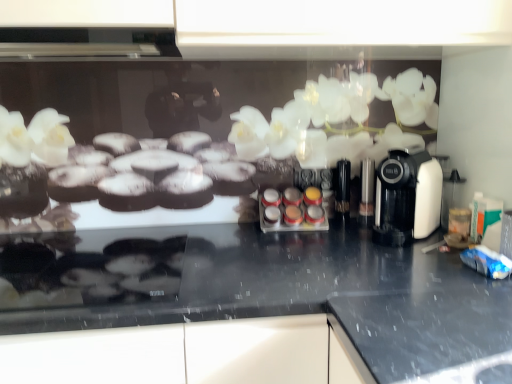
Question: Is white plastic coffee machine at right behind black granite countertop at center?

Choices:
 (A) no
 (B) yes

Answer: (B)

Question: Is white plastic coffee machine at right facing away from black granite countertop at center?

Choices:
 (A) no
 (B) yes

Answer: (A)

Question: Is white plastic coffee machine at right to the right of black granite countertop at center from the viewer's perspective?

Choices:
 (A) no
 (B) yes

Answer: (B)

Question: Can you confirm if white plastic coffee machine at right is bigger than black granite countertop at center?

Choices:
 (A) no
 (B) yes

Answer: (A)

Question: From the image's perspective, is white plastic coffee machine at right on black granite countertop at center?

Choices:
 (A) no
 (B) yes

Answer: (B)

Question: Is black granite countertop at center surrounded by white plastic coffee machine at right?

Choices:
 (A) no
 (B) yes

Answer: (A)

Question: Is white plastic coffee machine at right to the right of translucent plastic spice rack at center from the viewer's perspective?

Choices:
 (A) no
 (B) yes

Answer: (B)

Question: Is white plastic coffee machine at right facing away from translucent plastic spice rack at center?

Choices:
 (A) no
 (B) yes

Answer: (A)

Question: From the image's perspective, would you say white plastic coffee machine at right is shown under translucent plastic spice rack at center?

Choices:
 (A) no
 (B) yes

Answer: (A)

Question: Is the depth of white plastic coffee machine at right greater than that of translucent plastic spice rack at center?

Choices:
 (A) no
 (B) yes

Answer: (A)

Question: Is white plastic coffee machine at right wider than translucent plastic spice rack at center?

Choices:
 (A) yes
 (B) no

Answer: (A)

Question: From a real-world perspective, is white plastic coffee machine at right positioned under translucent plastic spice rack at center based on gravity?

Choices:
 (A) yes
 (B) no

Answer: (B)

Question: Considering the relative positions of black granite countertop at center and translucent plastic spice rack at center in the image provided, is black granite countertop at center behind translucent plastic spice rack at center?

Choices:
 (A) no
 (B) yes

Answer: (A)